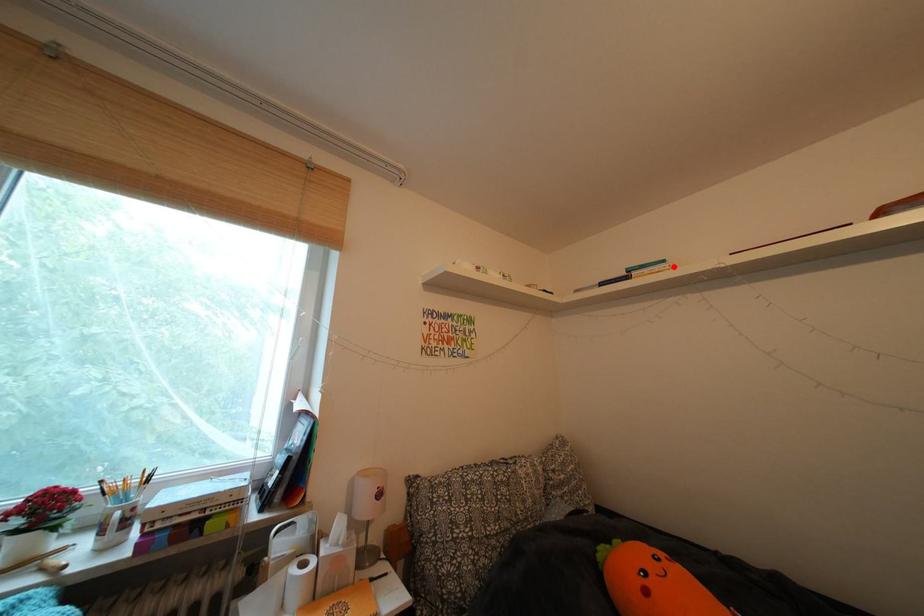
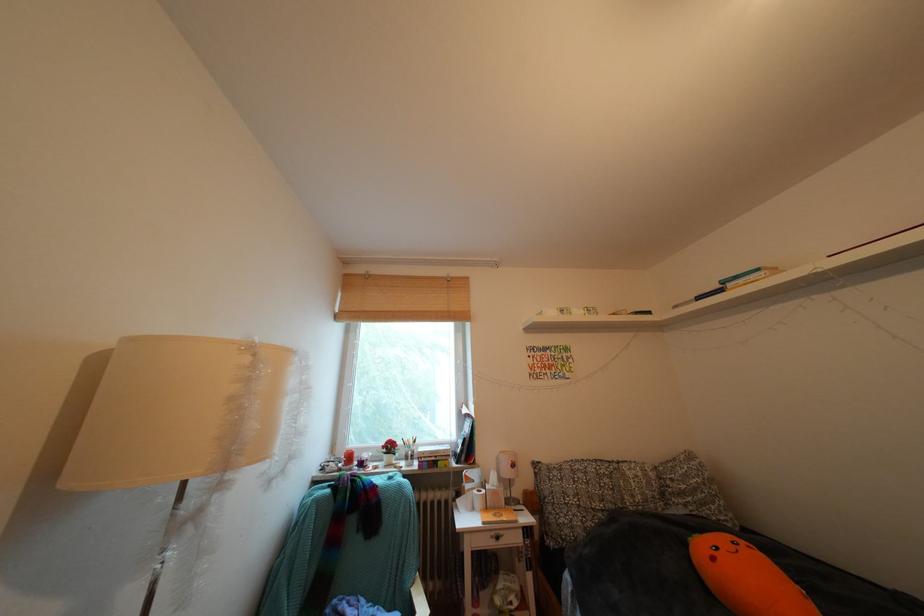
Find the pixel in the second image that matches the highlighted location in the first image.

(768, 275)